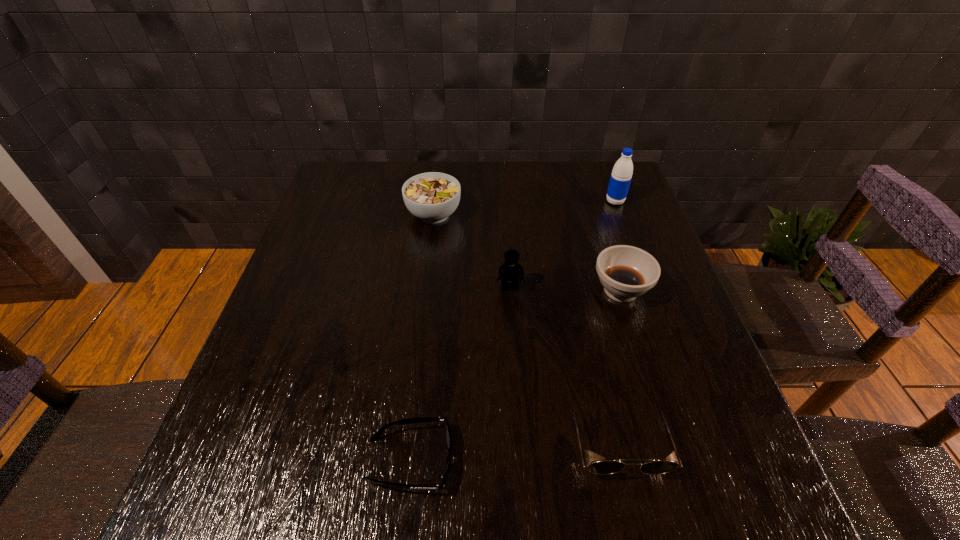
Where is `object that is at the near right corner`? object that is at the near right corner is located at coordinates (655, 467).

In the image, there is a desktop. Identify the location of free space at the far edge. The image size is (960, 540). (427, 167).

Image resolution: width=960 pixels, height=540 pixels. Find the location of `free space at the near edge of the desktop`. free space at the near edge of the desktop is located at coordinates (616, 482).

The width and height of the screenshot is (960, 540). I want to click on vacant area at the left edge, so click(x=261, y=364).

Identify the location of blank space at the right edge of the desktop. The image size is (960, 540). (645, 362).

Image resolution: width=960 pixels, height=540 pixels. I want to click on free space at the far right corner of the desktop, so click(584, 164).

This screenshot has width=960, height=540. I want to click on free space between the fourth object from right to left and the shorter sunglasses, so click(460, 374).

This screenshot has height=540, width=960. Find the location of `unoccupied position between the left soup bowl and the right sunglasses`. unoccupied position between the left soup bowl and the right sunglasses is located at coordinates (525, 327).

The width and height of the screenshot is (960, 540). I want to click on vacant space that's between the left sunglasses and the left soup bowl, so click(421, 337).

Image resolution: width=960 pixels, height=540 pixels. Identify the location of free spot between the shorter sunglasses and the right sunglasses. (514, 450).